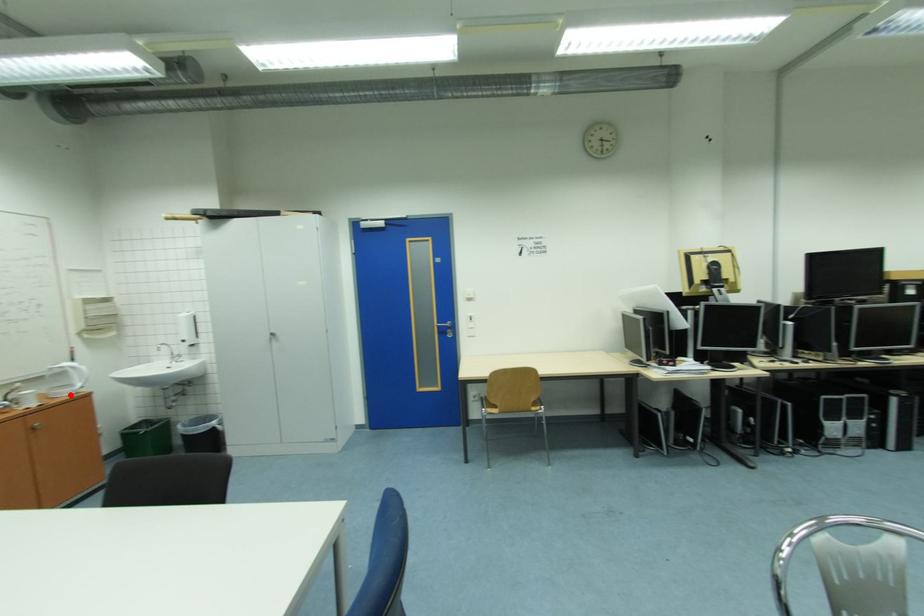
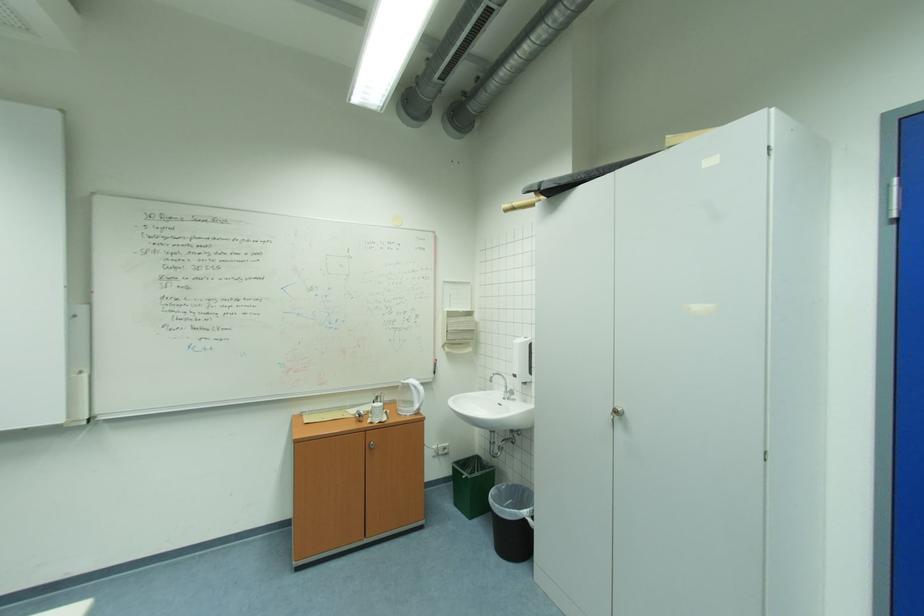
Question: I am providing you with two images of the same scene from different viewpoints. In image1, a red point is highlighted. Considering the same 3D point in image2, which of the following is correct?

Choices:
 (A) It is closer
 (B) It is farther

Answer: (B)